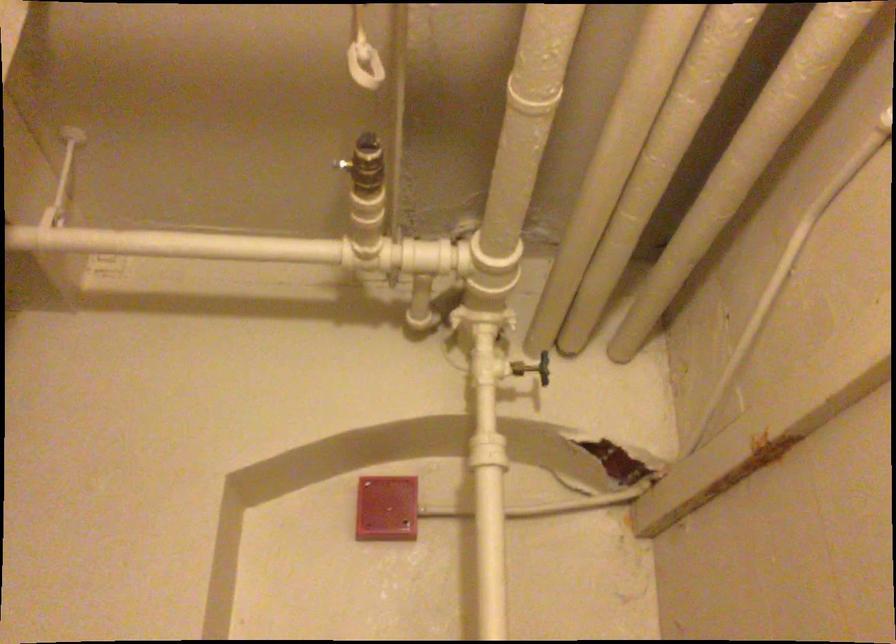
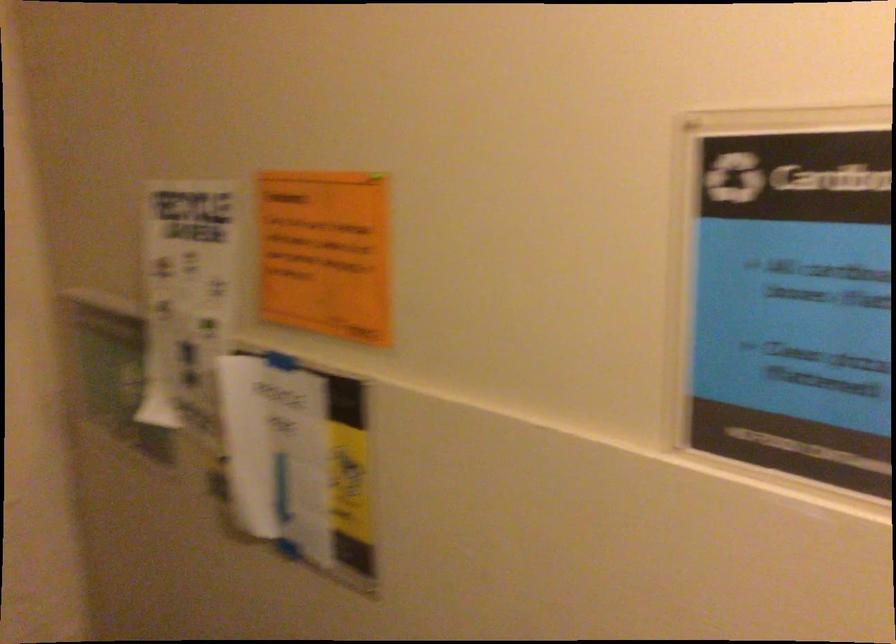
First-person continuous shooting, in which direction is the camera rotating?

The camera's rotation is toward right-down.